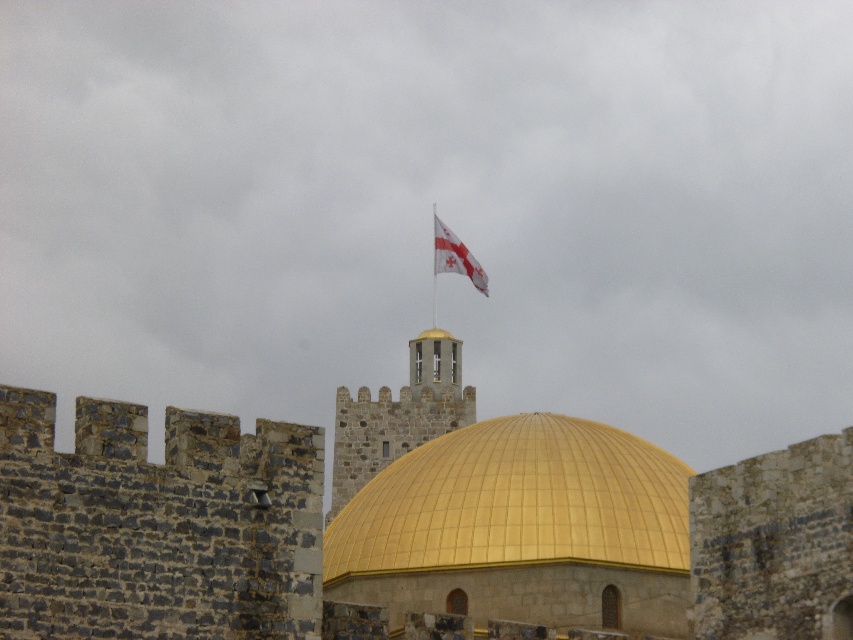
Question: Which point appears closest to the camera in this image?

Choices:
 (A) (485, 278)
 (B) (682, 465)

Answer: (B)

Question: Does gold metallic dome at center appear on the right side of white fabric flag at upper center?

Choices:
 (A) yes
 (B) no

Answer: (B)

Question: Which point is farther to the camera?

Choices:
 (A) white fabric flag at upper center
 (B) gold metallic dome at center

Answer: (A)

Question: Among these points, which one is nearest to the camera?

Choices:
 (A) (426, 444)
 (B) (445, 268)

Answer: (A)

Question: Does gold metallic dome at center lie in front of white fabric flag at upper center?

Choices:
 (A) no
 (B) yes

Answer: (B)

Question: Is gold metallic dome at center above white fabric flag at upper center?

Choices:
 (A) yes
 (B) no

Answer: (B)